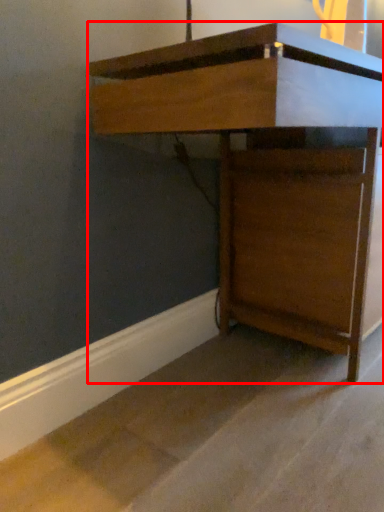
Question: In this image, where is furniture (annotated by the red box) located relative to concrete?

Choices:
 (A) right
 (B) left

Answer: (A)